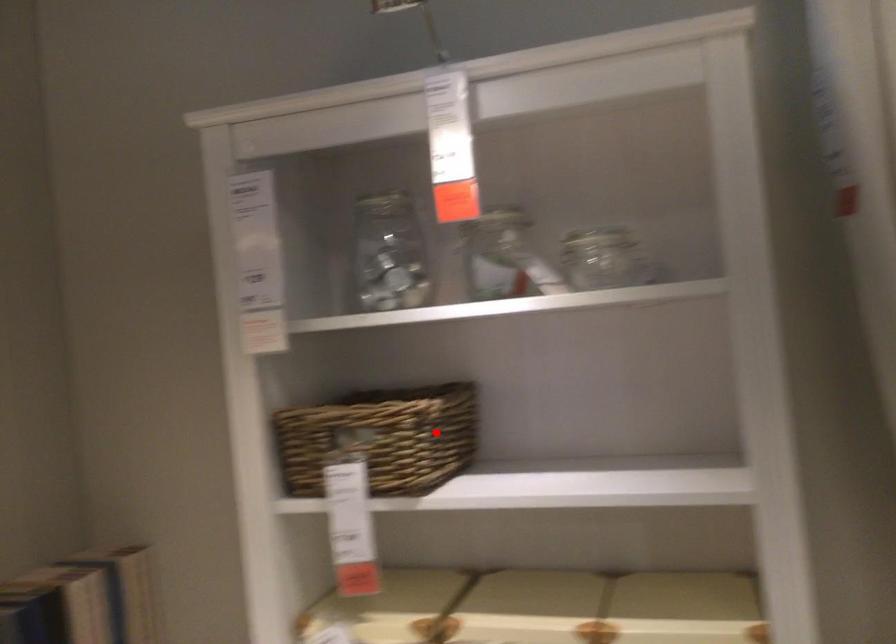
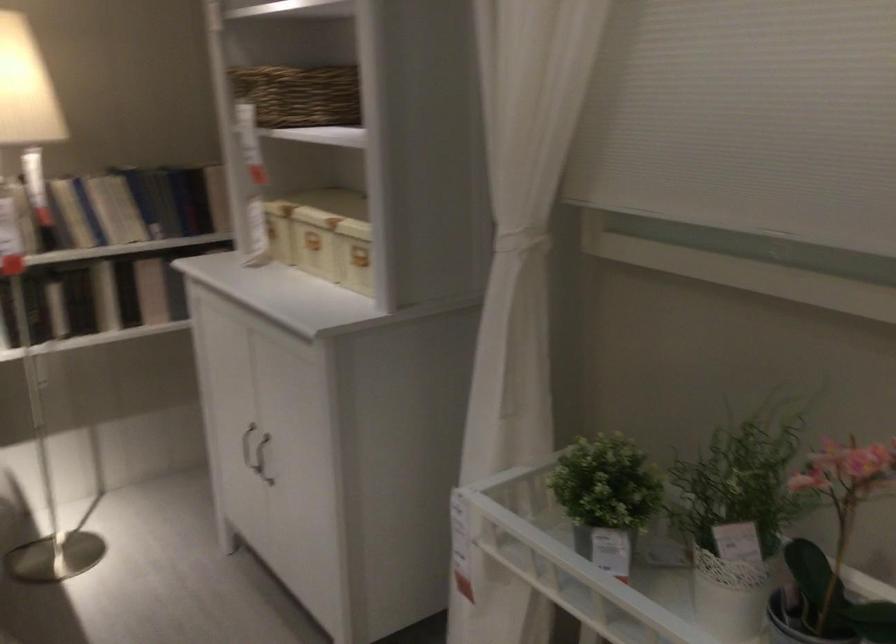
Question: I am providing you with two images of the same scene from different viewpoints. A red point is shown in image1. For the corresponding object point in image2, is it positioned nearer or farther from the camera?

Choices:
 (A) Nearer
 (B) Farther

Answer: (B)